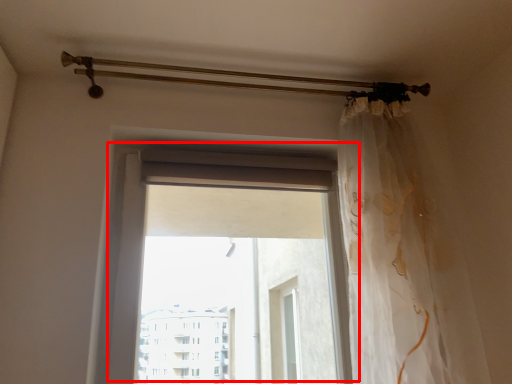
Question: From the image's perspective, what is the correct spatial positioning of window (annotated by the red box) in reference to curtain?

Choices:
 (A) above
 (B) below

Answer: (B)